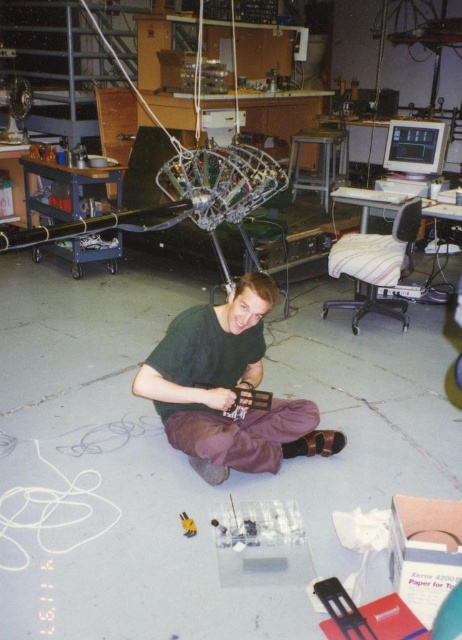
Does green matte shirt at center have a greater width compared to yellow plastic screwdriver at lower center?

Yes.

Is point (198, 355) positioned behind point (184, 515)?

Yes.

Between point (323, 451) and point (181, 518), which one is positioned behind?

The point (323, 451) is more distant.

This screenshot has height=640, width=462. I want to click on green matte shirt at center, so click(x=226, y=388).